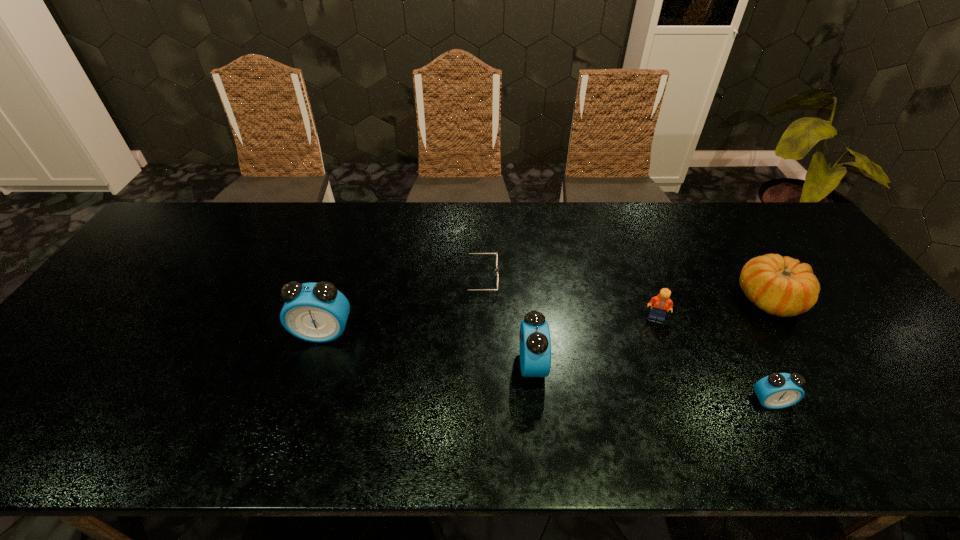
At what (x,y) coordinates should I click in order to perform the action: click on free spot that satisfies the following two spatial constraints: 1. on the front-facing side of the Lego; 2. on the face of the fourth object from right to left. Please return your answer as a coordinate pair (x, y). The image size is (960, 540). Looking at the image, I should click on (675, 365).